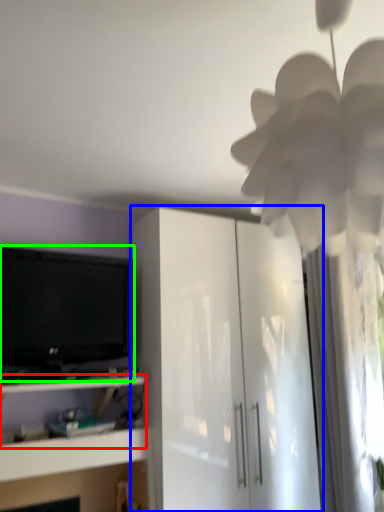
Question: Which is nearer to the shelf (highlighted by a red box)? cabinetry (highlighted by a blue box) or television (highlighted by a green box).

Choices:
 (A) cabinetry
 (B) television

Answer: (B)